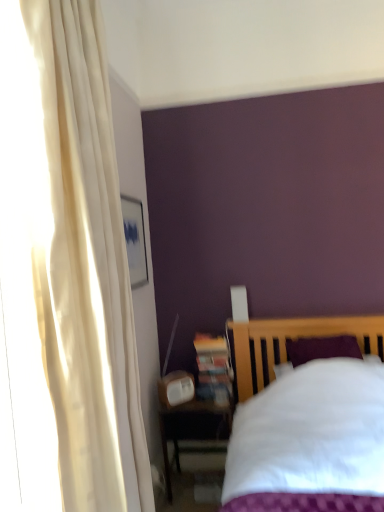
Question: Is point (228, 382) positioned closer to the camera than point (248, 480)?

Choices:
 (A) closer
 (B) farther

Answer: (B)

Question: From the image's perspective, is wooden bookshelf at lower center positioned above or below white cotton bed at lower right?

Choices:
 (A) below
 (B) above

Answer: (B)

Question: Considering the real-world distances, which object is closest to the matte wooden nightstand at lower left?

Choices:
 (A) white cotton bed at lower right
 (B) wooden bookshelf at lower center

Answer: (B)

Question: Which object is the farthest from the matte wooden nightstand at lower left?

Choices:
 (A) wooden bookshelf at lower center
 (B) white cotton bed at lower right

Answer: (B)